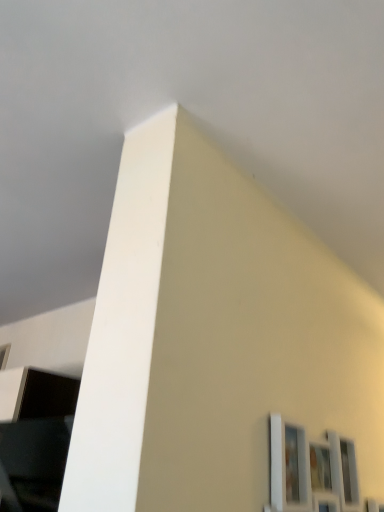
Measure the distance between point (3, 367) and camera.

A distance of 7.54 feet exists between point (3, 367) and camera.

In order to click on transparent glass window at lower left in this screenshot , I will do `click(4, 355)`.

What do you see at coordinates (4, 355) in the screenshot? The width and height of the screenshot is (384, 512). I see `transparent glass window at lower left` at bounding box center [4, 355].

Locate an element on the screen. Image resolution: width=384 pixels, height=512 pixels. transparent glass window at lower left is located at coordinates (4, 355).